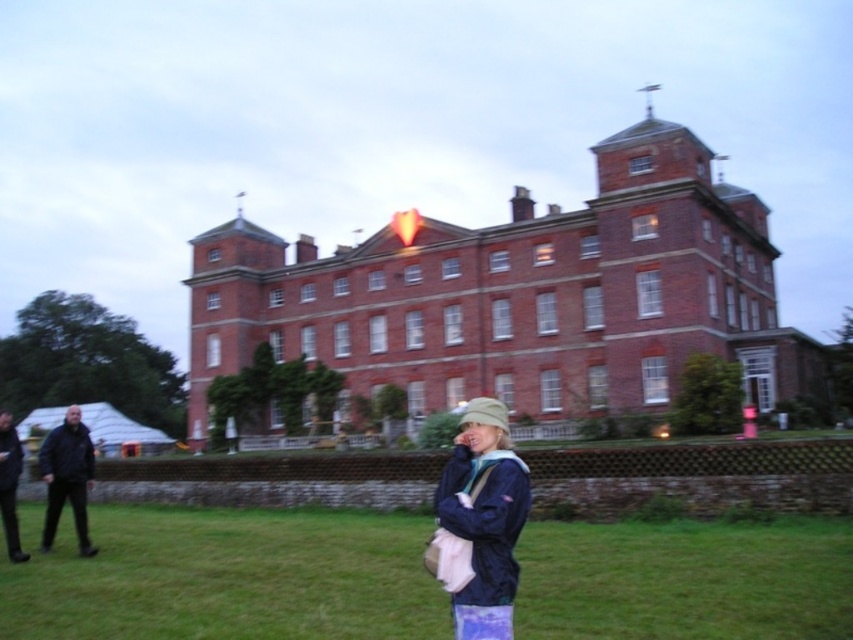
Between navy blue jacket at lower center and black fabric jacket at left, which one appears on the right side from the viewer's perspective?

navy blue jacket at lower center is more to the right.

Find the location of a particular element. The height and width of the screenshot is (640, 853). navy blue jacket at lower center is located at coordinates (480, 522).

Where is `navy blue jacket at lower center`? navy blue jacket at lower center is located at coordinates (480, 522).

Can you confirm if navy blue jacket at lower center is positioned to the left of black leather jacket at lower left?

Incorrect, navy blue jacket at lower center is not on the left side of black leather jacket at lower left.

Is navy blue jacket at lower center to the right of black leather jacket at lower left from the viewer's perspective?

Yes, navy blue jacket at lower center is to the right of black leather jacket at lower left.

Which is in front, point (492, 513) or point (4, 488)?

Point (492, 513) is in front.

Where is `navy blue jacket at lower center`? This screenshot has height=640, width=853. navy blue jacket at lower center is located at coordinates (480, 522).

Between green grass at lower center and navy blue jacket at lower center, which one has less height?

green grass at lower center is shorter.

Locate an element on the screen. The image size is (853, 640). green grass at lower center is located at coordinates (229, 577).

Which is in front, point (587, 547) or point (519, 515)?

Point (519, 515)

Where is `green grass at lower center`? The height and width of the screenshot is (640, 853). green grass at lower center is located at coordinates (229, 577).